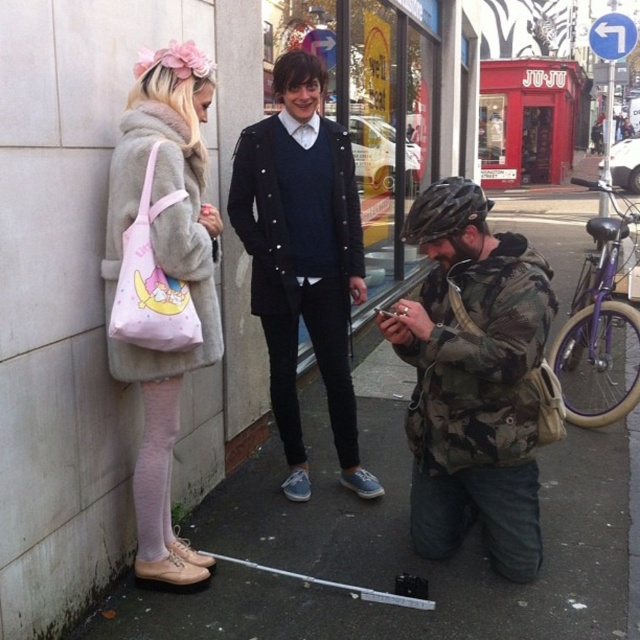
Question: Which object appears closest to the camera in this image?

Choices:
 (A) camo jacket at lower right
 (B) fuzzy beige coat at left
 (C) matte black coat at upper center
 (D) red matte storefront at center

Answer: (B)

Question: Does pink fabric bag at left appear on the left side of fuzzy beige coat at left?

Choices:
 (A) yes
 (B) no

Answer: (B)

Question: Is fuzzy beige coat at left smaller than red matte storefront at center?

Choices:
 (A) yes
 (B) no

Answer: (A)

Question: Is pink fabric bag at left below red matte storefront at center?

Choices:
 (A) no
 (B) yes

Answer: (B)

Question: Which of the following is the closest to the observer?

Choices:
 (A) (481, 480)
 (B) (147, 442)

Answer: (B)

Question: Among these points, which one is nearest to the camera?

Choices:
 (A) (580, 506)
 (B) (173, 92)

Answer: (B)